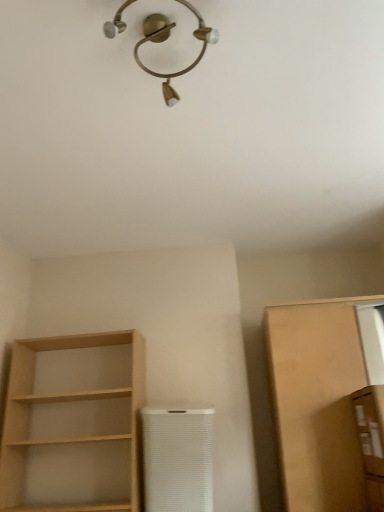
Question: Is brown cardboard box at right, the second cabinetry viewed from the back, at the left side of white textured air purifier at center?

Choices:
 (A) no
 (B) yes

Answer: (A)

Question: Does brown cardboard box at right, the second cabinetry viewed from the back, come in front of white textured air purifier at center?

Choices:
 (A) yes
 (B) no

Answer: (A)

Question: Does brown cardboard box at right, which is the first cabinetry from front to back, have a lesser height compared to white textured air purifier at center?

Choices:
 (A) yes
 (B) no

Answer: (A)

Question: Is brown cardboard box at right, the second cabinetry viewed from the back, bigger than white textured air purifier at center?

Choices:
 (A) no
 (B) yes

Answer: (A)

Question: From a real-world perspective, is brown cardboard box at right, the second cabinetry viewed from the back, physically below white textured air purifier at center?

Choices:
 (A) no
 (B) yes

Answer: (A)

Question: Choose the correct answer: Is matte brown cabinet at right, acting as the 2th cabinetry starting from the front, inside brown cardboard box at right, the second cabinetry viewed from the back, or outside it?

Choices:
 (A) inside
 (B) outside

Answer: (B)

Question: From a real-world perspective, is matte brown cabinet at right, the first cabinetry viewed from the back, positioned above or below brown cardboard box at right, which is the first cabinetry from front to back?

Choices:
 (A) above
 (B) below

Answer: (A)

Question: In the image, is matte brown cabinet at right, the first cabinetry viewed from the back, positioned in front of or behind brown cardboard box at right, the second cabinetry viewed from the back?

Choices:
 (A) behind
 (B) front

Answer: (A)

Question: Is point (355, 346) closer or farther from the camera than point (360, 450)?

Choices:
 (A) closer
 (B) farther

Answer: (B)

Question: Is gold metallic light fixture at upper center wider or thinner than matte brown cabinet at right, acting as the 2th cabinetry starting from the front?

Choices:
 (A) wide
 (B) thin

Answer: (B)

Question: From the image's perspective, is gold metallic light fixture at upper center above or below matte brown cabinet at right, the first cabinetry viewed from the back?

Choices:
 (A) above
 (B) below

Answer: (A)

Question: From a real-world perspective, is gold metallic light fixture at upper center physically located above or below matte brown cabinet at right, the first cabinetry viewed from the back?

Choices:
 (A) above
 (B) below

Answer: (A)

Question: Considering the positions of gold metallic light fixture at upper center and matte brown cabinet at right, the first cabinetry viewed from the back, in the image, is gold metallic light fixture at upper center taller or shorter than matte brown cabinet at right, the first cabinetry viewed from the back,?

Choices:
 (A) tall
 (B) short

Answer: (B)

Question: In the image, is white textured air purifier at center positioned in front of or behind light wood shelf at left?

Choices:
 (A) behind
 (B) front

Answer: (A)

Question: From a real-world perspective, is white textured air purifier at center positioned above or below light wood shelf at left?

Choices:
 (A) below
 (B) above

Answer: (A)